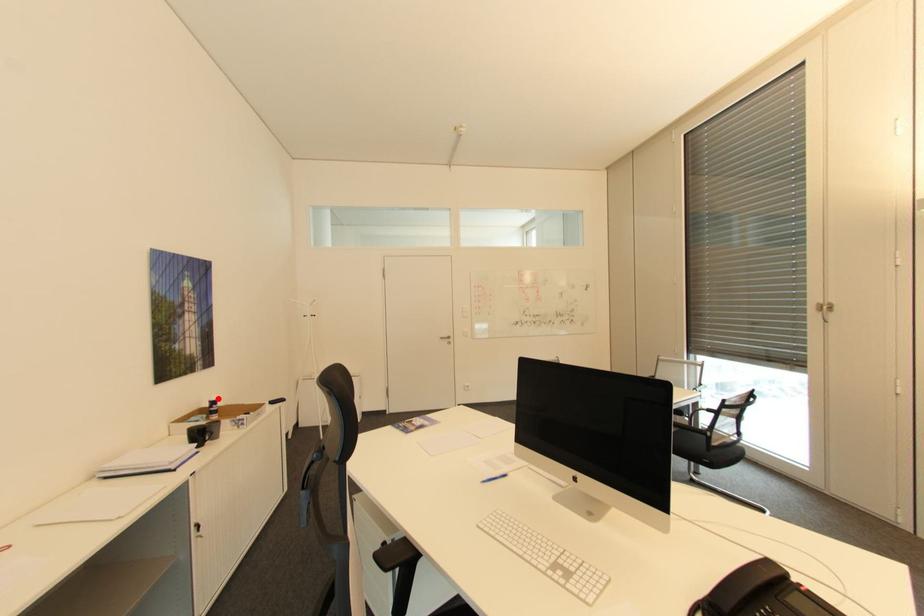
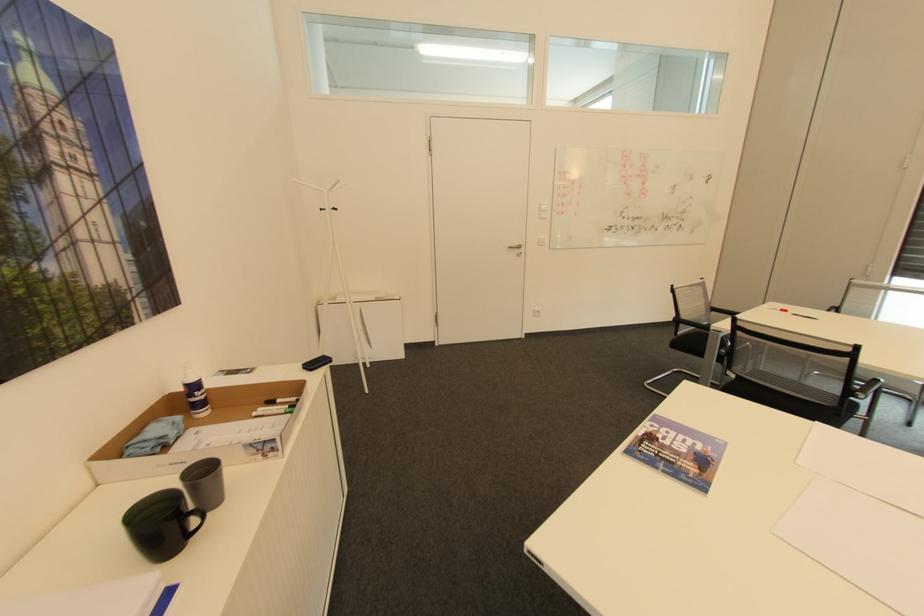
Find the pixel in the second image that matches the highlighted location in the first image.

(197, 379)